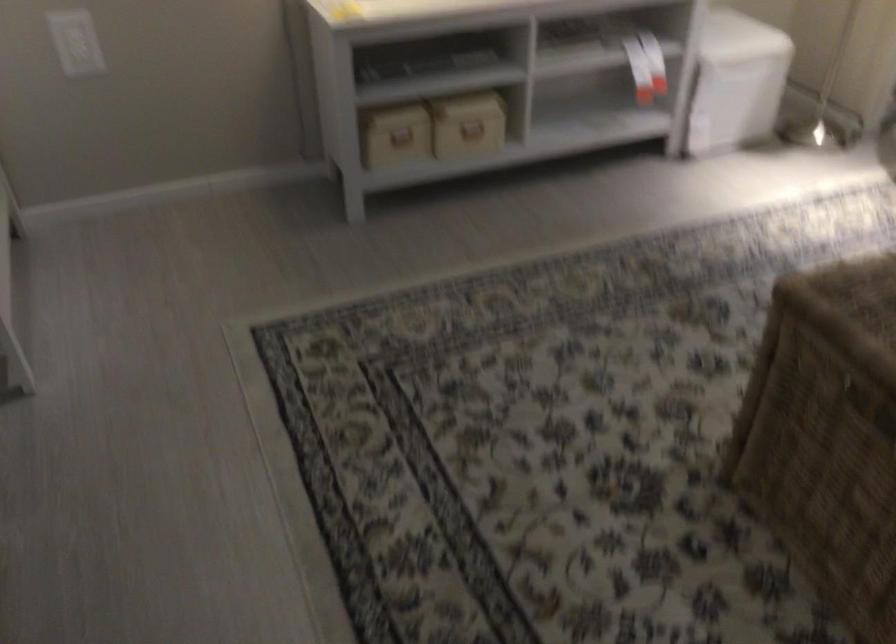
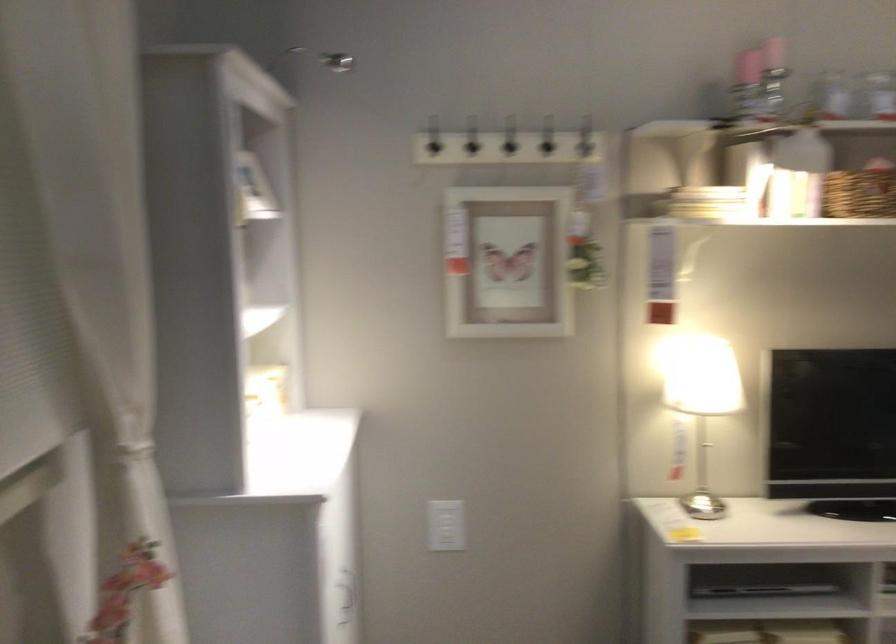
From the picture: The first image is from the beginning of the video and the second image is from the end. How did the camera likely rotate when shooting the video?

The camera's rotation is toward left-up.